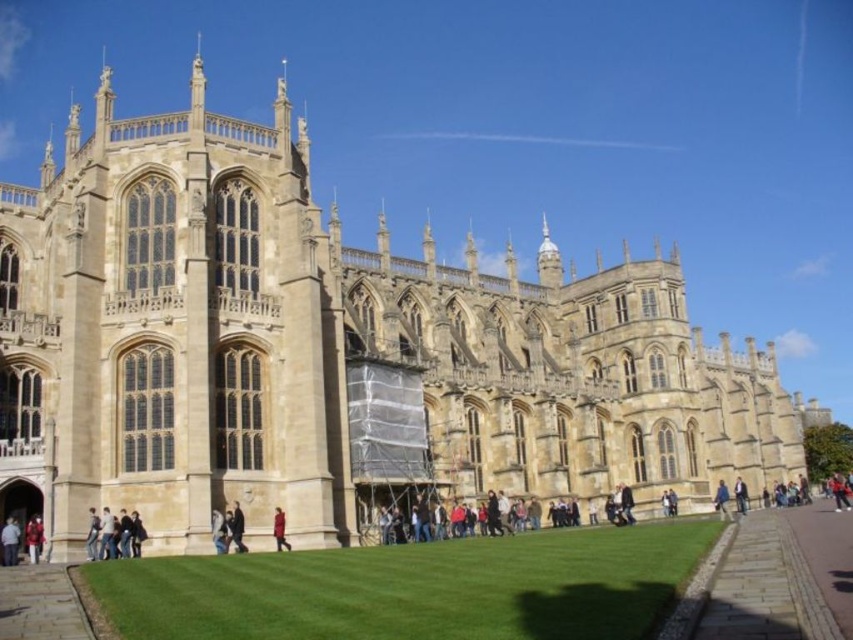
Can you confirm if red fabric coat at lower center is smaller than blue fabric jacket at lower right?

Yes, red fabric coat at lower center is smaller than blue fabric jacket at lower right.

Can you confirm if red fabric coat at lower center is positioned above blue fabric jacket at lower right?

Correct, red fabric coat at lower center is located above blue fabric jacket at lower right.

Is point (283, 541) positioned in front of point (728, 508)?

Yes, it is.

Locate an element on the screen. red fabric coat at lower center is located at coordinates (279, 529).

Who is positioned more to the left, green grass at lower center or dark blue jacket at center?

From the viewer's perspective, dark blue jacket at center appears more on the left side.

Locate an element on the screen. The image size is (853, 640). green grass at lower center is located at coordinates (415, 588).

This screenshot has width=853, height=640. Describe the element at coordinates (10, 541) in the screenshot. I see `light brown leather jacket at lower left` at that location.

In the scene shown: Is light brown leather jacket at lower left to the right of dark blue jacket at lower right from the viewer's perspective?

Incorrect, light brown leather jacket at lower left is not on the right side of dark blue jacket at lower right.

Does point (0, 538) come closer to viewer compared to point (744, 499)?

Yes, it is.

Locate an element on the screen. This screenshot has height=640, width=853. light brown leather jacket at lower left is located at coordinates (10, 541).